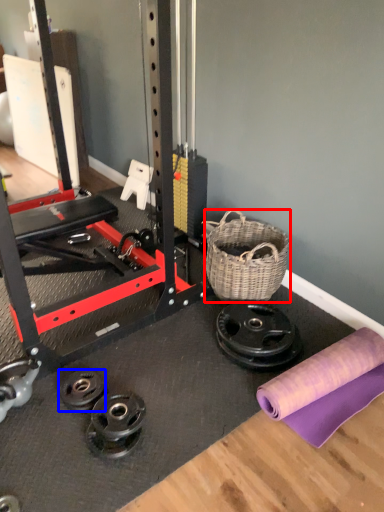
Question: Which point is closer to the camera, basket (highlighted by a red box) or wheel (highlighted by a blue box)?

Choices:
 (A) basket
 (B) wheel

Answer: (B)